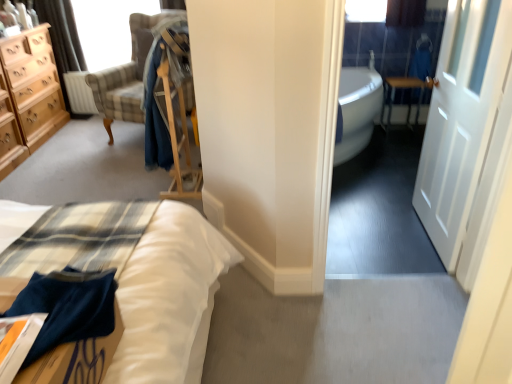
From a real-world perspective, find some spots in the free space above clear glass window screen at upper left. Your answer should be formatted as a list of tuples, i.e. [(x1, y1)], where each tuple contains the x and y coordinates of a point satisfying the conditions above.

[(0.229, -0.000)]